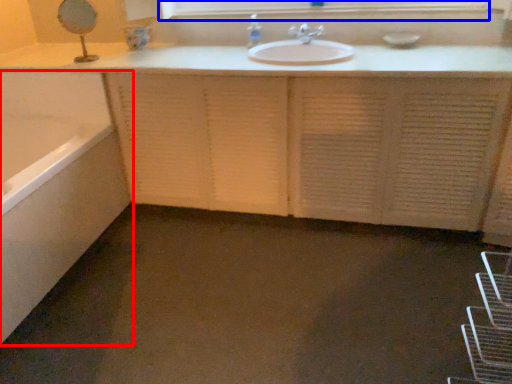
Question: Which point is further to the camera, bathtub (highlighted by a red box) or medicine cabinet (highlighted by a blue box)?

Choices:
 (A) bathtub
 (B) medicine cabinet

Answer: (B)